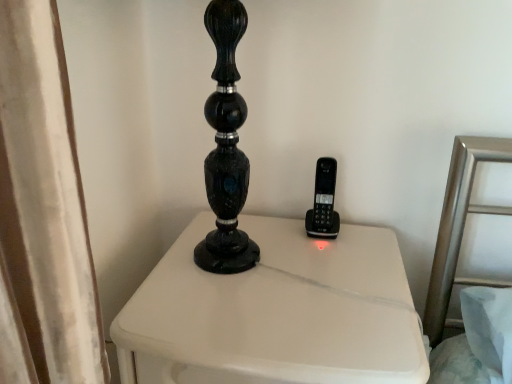
The width and height of the screenshot is (512, 384). Describe the element at coordinates (275, 312) in the screenshot. I see `white painted wood nightstand at center` at that location.

I want to click on white painted wood nightstand at center, so click(275, 312).

Locate an element on the screen. Image resolution: width=512 pixels, height=384 pixels. black plastic phone at center is located at coordinates (323, 202).

Describe the element at coordinates (323, 202) in the screenshot. I see `black plastic phone at center` at that location.

In order to face black plastic phone at center, should I rotate leftwards or rightwards?

Rotate your view right by about 9.637°.

This screenshot has height=384, width=512. In order to click on white painted wood nightstand at center in this screenshot , I will do `click(275, 312)`.

Is white painted wood nightstand at center to the right of black plastic phone at center from the viewer's perspective?

In fact, white painted wood nightstand at center is to the left of black plastic phone at center.

Considering their positions, is white painted wood nightstand at center located in front of or behind black plastic phone at center?

white painted wood nightstand at center is positioned closer to the viewer than black plastic phone at center.

Considering the points (336, 274) and (329, 166), which point is in front, point (336, 274) or point (329, 166)?

Positioned in front is point (336, 274).

Based on the photo, from the image's perspective, is white painted wood nightstand at center above or below black plastic phone at center?

Clearly, from the image's perspective, white painted wood nightstand at center is below black plastic phone at center.

From a real-world perspective, between white painted wood nightstand at center and black plastic phone at center, who is vertically lower?

In real-world perspective, white painted wood nightstand at center is lower.

Which of these two, white painted wood nightstand at center or black plastic phone at center, is wider?

Wider between the two is white painted wood nightstand at center.

From their relative heights in the image, would you say white painted wood nightstand at center is taller or shorter than black plastic phone at center?

Clearly, white painted wood nightstand at center is taller compared to black plastic phone at center.

Can you confirm if white painted wood nightstand at center is bigger than black plastic phone at center?

Indeed, white painted wood nightstand at center has a larger size compared to black plastic phone at center.

Could black plastic phone at center be considered to be inside white painted wood nightstand at center?

Actually, black plastic phone at center is outside white painted wood nightstand at center.

Are white painted wood nightstand at center and black plastic phone at center beside each other?

white painted wood nightstand at center and black plastic phone at center are clearly separated.

Could you tell me if white painted wood nightstand at center is turned towards black plastic phone at center?

No, white painted wood nightstand at center is not turned towards black plastic phone at center.

Looking at this image, how distant is white painted wood nightstand at center from black plastic phone at center?

They are 24.21 centimeters apart.

There is a white painted wood nightstand at center. At what (x,y) coordinates should I click in order to perform the action: click on control above it (from a real-world perspective). Please return your answer as a coordinate pair (x, y). This screenshot has height=384, width=512. Looking at the image, I should click on (323, 202).

Is black plastic phone at center at the right side of white painted wood nightstand at center?

Yes, black plastic phone at center is to the right of white painted wood nightstand at center.

Which object is closer to the camera, black plastic phone at center or white painted wood nightstand at center?

Positioned in front is white painted wood nightstand at center.

Between point (321, 213) and point (241, 291), which one is positioned behind?

Point (321, 213)

From the image's perspective, does black plastic phone at center appear lower than white painted wood nightstand at center?

Incorrect, from the image's perspective, black plastic phone at center is higher than white painted wood nightstand at center.

From a real-world perspective, is black plastic phone at center physically located above or below white painted wood nightstand at center?

Clearly, from a real-world perspective, black plastic phone at center is above white painted wood nightstand at center.

Which of these two, black plastic phone at center or white painted wood nightstand at center, is wider?

With larger width is white painted wood nightstand at center.

Considering the relative sizes of black plastic phone at center and white painted wood nightstand at center in the image provided, is black plastic phone at center taller than white painted wood nightstand at center?

In fact, black plastic phone at center may be shorter than white painted wood nightstand at center.

Can you confirm if black plastic phone at center is bigger than white painted wood nightstand at center?

No.

In the scene shown: Is black plastic phone at center located outside white painted wood nightstand at center?

Indeed, black plastic phone at center is completely outside white painted wood nightstand at center.

Is black plastic phone at center positioned far away from white painted wood nightstand at center?

black plastic phone at center is actually quite close to white painted wood nightstand at center.

Does black plastic phone at center turn towards white painted wood nightstand at center?

No, black plastic phone at center is not aimed at white painted wood nightstand at center.

Looking at this image, how different are the orientations of black plastic phone at center and white painted wood nightstand at center in degrees?

The angle between the facing direction of black plastic phone at center and the facing direction of white painted wood nightstand at center is 0.0795 degrees.

Locate an element on the screen. Image resolution: width=512 pixels, height=384 pixels. control behind the white painted wood nightstand at center is located at coordinates (323, 202).

Where is `control that appears above the white painted wood nightstand at center (from a real-world perspective)`? This screenshot has width=512, height=384. control that appears above the white painted wood nightstand at center (from a real-world perspective) is located at coordinates pos(323,202).

The image size is (512, 384). Identify the location of furniture in front of the black plastic phone at center. (275, 312).